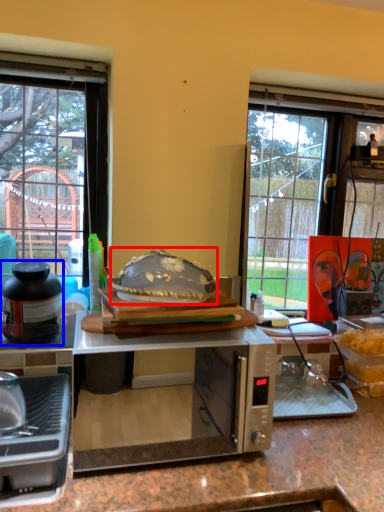
Question: Which point is further to the camera, food (highlighted by a red box) or kitchen appliance (highlighted by a blue box)?

Choices:
 (A) food
 (B) kitchen appliance

Answer: (B)